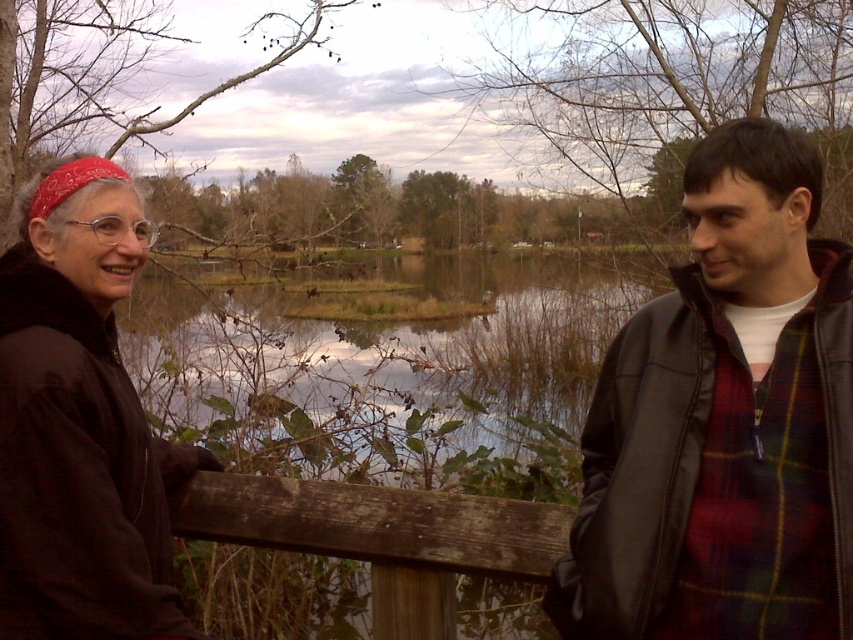
You are planning to buy a jacket similar to the ones in the image. The leather jacket at right is 40 cm wide. Can the matte black jacket at left fit into a storage box that can only accommodate items up to 35 cm in width?

The leather jacket at right is wider than the matte black jacket at left. Since the leather jacket at right is 40 cm wide, the matte black jacket at left must be narrower than 40 cm. However, the exact width of the matte black jacket at left is not provided. Therefore, it is uncertain if it will fit into a 35 cm width storage box without more specific information.

You are a photographer setting up a tripod in this scene. You need to place it between the leather jacket at right and the weathered wood fence at center. Given that the tripod requires at least 1 meter of space between its legs to stabilize, can you fit it in the available space?

The leather jacket at right is narrower than the weathered wood fence at center. However, the exact width of the space between them isn not specified. Since the tripod needs 1 meter, we cannot confirm if it fits without knowing the actual distance between the two objects.

You are a photographer trying to capture a photo of the weathered wood fence at center without the matte black jacket at left blocking it. Based on the scene, can you position yourself so that the fence is visible without the jacket obstructing it?

The matte black jacket at left is positioned over the weathered wood fence at center, so moving to a position where you can see the fence from below or behind the jacket might allow you to capture the fence without obstruction.